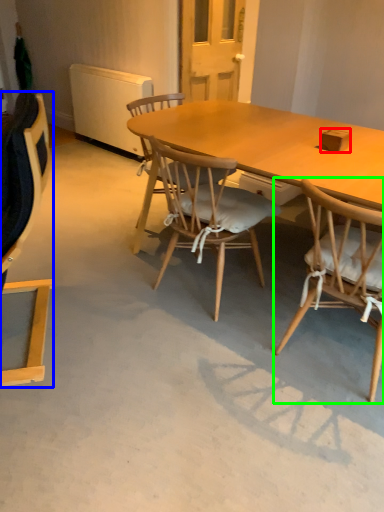
Question: Considering the real-world distances, which object is closest to box (highlighted by a red box)? chair (highlighted by a blue box) or chair (highlighted by a green box).

Choices:
 (A) chair
 (B) chair

Answer: (B)